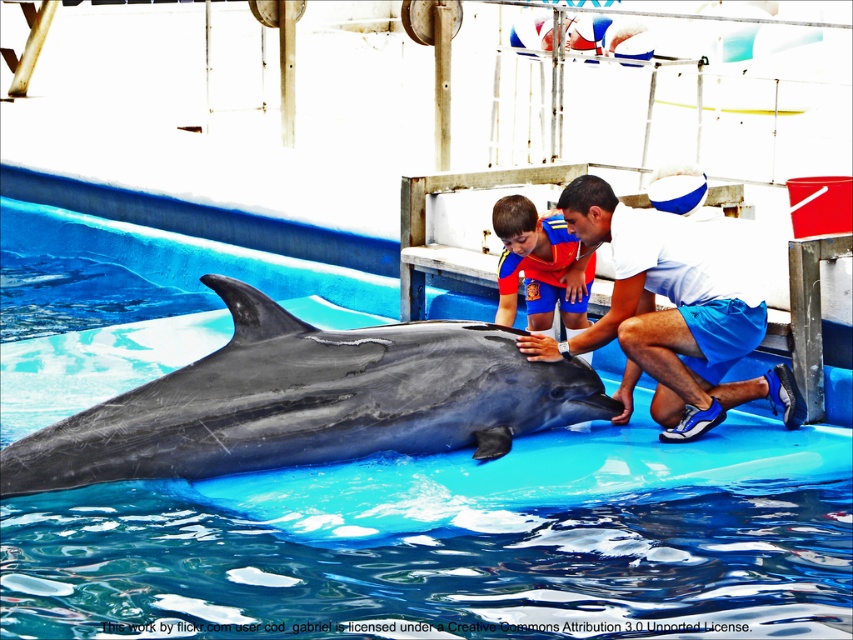
Question: Considering the relative positions of blue rubber pool at center and white matte shirt at center in the image provided, where is blue rubber pool at center located with respect to white matte shirt at center?

Choices:
 (A) left
 (B) right

Answer: (A)

Question: Does white matte shirt at center appear on the left side of matte blue shorts at center?

Choices:
 (A) no
 (B) yes

Answer: (A)

Question: Which of the following is the closest to the observer?

Choices:
 (A) gray smooth dolphin at center
 (B) blue rubber pool at center
 (C) white matte shirt at center
 (D) matte blue shorts at center

Answer: (B)

Question: Can you confirm if blue rubber pool at center is positioned to the right of gray smooth dolphin at center?

Choices:
 (A) yes
 (B) no

Answer: (B)

Question: Which of the following is the closest to the observer?

Choices:
 (A) white matte shirt at center
 (B) matte blue shorts at center
 (C) blue rubber pool at center

Answer: (C)

Question: Estimate the real-world distances between objects in this image. Which object is farther from the white matte shirt at center?

Choices:
 (A) blue rubber pool at center
 (B) gray smooth dolphin at center
 (C) matte blue shorts at center

Answer: (B)